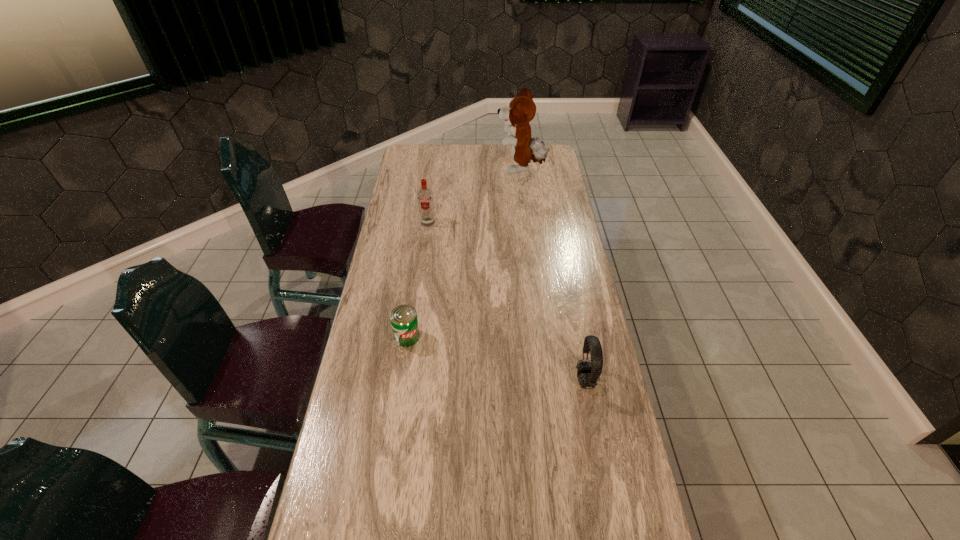
The image size is (960, 540). In order to click on puppy in this screenshot , I will do `click(521, 110)`.

This screenshot has width=960, height=540. I want to click on the tallest object, so click(521, 110).

At what (x,y) coordinates should I click in order to perform the action: click on the second farthest object. Please return your answer as a coordinate pair (x, y). Looking at the image, I should click on click(425, 196).

At what (x,y) coordinates should I click in order to perform the action: click on the second tallest object. Please return your answer as a coordinate pair (x, y). Image resolution: width=960 pixels, height=540 pixels. Looking at the image, I should click on (425, 196).

Where is `the nearest object`? The width and height of the screenshot is (960, 540). the nearest object is located at coordinates [588, 373].

Locate an element on the screen. the third tallest object is located at coordinates (588, 373).

Locate an element on the screen. This screenshot has width=960, height=540. can is located at coordinates (404, 322).

This screenshot has width=960, height=540. I want to click on the shortest object, so (x=404, y=322).

Locate an element on the screen. Image resolution: width=960 pixels, height=540 pixels. free space located on the face of the tallest object is located at coordinates (427, 170).

Where is `vacant point located on the face of the tallest object`? vacant point located on the face of the tallest object is located at coordinates [x=468, y=170].